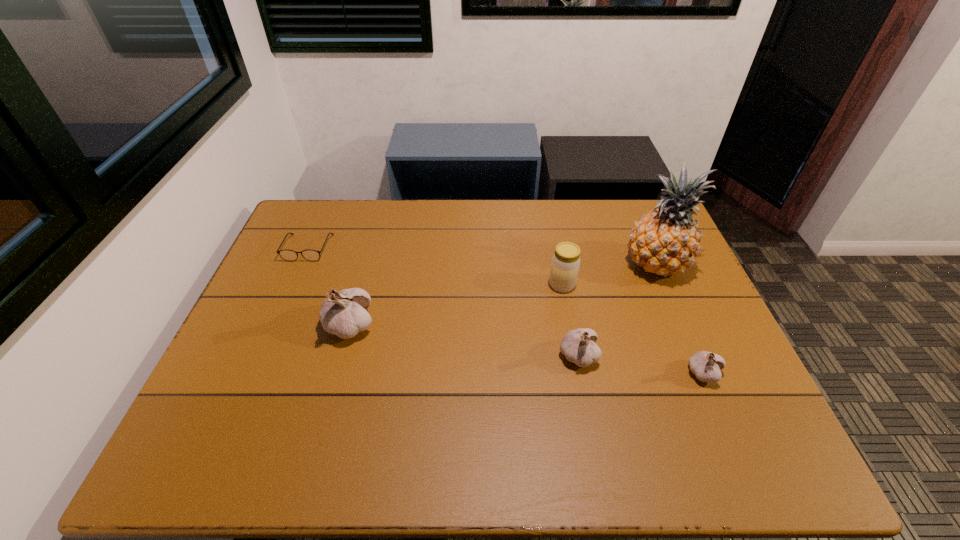
The image size is (960, 540). I want to click on free location at the far edge, so click(493, 239).

Identify the location of vacant space at the near edge of the desktop. The image size is (960, 540). (367, 400).

Locate an element on the screen. vacant area at the right edge of the desktop is located at coordinates (671, 275).

Identify the location of vacant space at the far left corner of the desktop. The image size is (960, 540). (284, 238).

Locate an element on the screen. Image resolution: width=960 pixels, height=540 pixels. vacant region at the near left corner of the desktop is located at coordinates (263, 410).

Where is `free spot between the shortest garlic and the tallest object`? Image resolution: width=960 pixels, height=540 pixels. free spot between the shortest garlic and the tallest object is located at coordinates (680, 319).

Image resolution: width=960 pixels, height=540 pixels. I want to click on empty space that is in between the jar and the fifth object from right to left, so click(456, 305).

You are a GUI agent. You are given a task and a screenshot of the screen. Output one action in this format:
    pyautogui.click(x=<x>, y=<y>)
    Task: Click on the vacant space in between the second tallest garlic and the fifth shortest object
    
    Given the screenshot: What is the action you would take?
    pyautogui.click(x=464, y=341)

You are a GUI agent. You are given a task and a screenshot of the screen. Output one action in this format:
    pyautogui.click(x=<x>, y=<y>)
    Task: Click on the vacant area that lies between the second shortest garlic and the leftmost garlic
    Image resolution: width=960 pixels, height=540 pixels.
    Given the screenshot: What is the action you would take?
    click(x=464, y=341)

Find the location of a particular element. free area in between the shortest garlic and the jar is located at coordinates (633, 329).